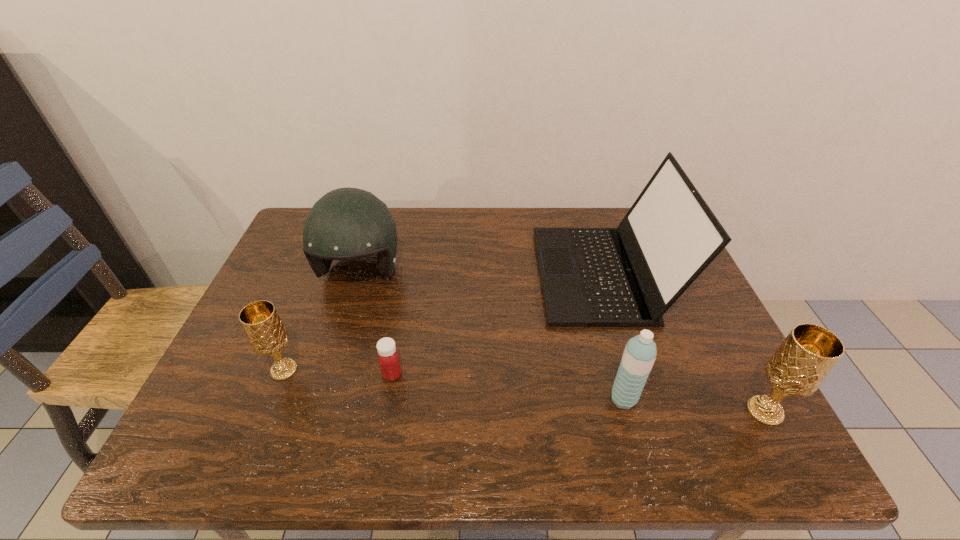
At what (x,y) coordinates should I click in order to perform the action: click on free space at the left edge. Please return your answer as a coordinate pair (x, y). The height and width of the screenshot is (540, 960). Looking at the image, I should click on (241, 350).

Image resolution: width=960 pixels, height=540 pixels. In order to click on vacant area at the near left corner in this screenshot , I will do `click(252, 384)`.

In the image, there is a desktop. Identify the location of vacant region at the far right corner. (616, 211).

At what (x,y) coordinates should I click in order to perform the action: click on free space that is in between the water bottle and the laptop. Please return your answer as a coordinate pair (x, y). This screenshot has height=540, width=960. Looking at the image, I should click on (613, 336).

The image size is (960, 540). Identify the location of empty location between the shorter chalice and the medicine. (338, 372).

The width and height of the screenshot is (960, 540). In order to click on free spot between the medicine and the left chalice in this screenshot , I will do `click(338, 372)`.

The image size is (960, 540). Identify the location of free space between the water bottle and the football helmet. (492, 336).

The image size is (960, 540). What are the coordinates of `blank region between the farther chalice and the nearer chalice` in the screenshot? It's located at (524, 390).

Locate an element on the screen. blank region between the rightmost object and the shorter chalice is located at coordinates (524, 390).

Locate an element on the screen. This screenshot has height=540, width=960. blank region between the taller chalice and the laptop is located at coordinates (684, 342).